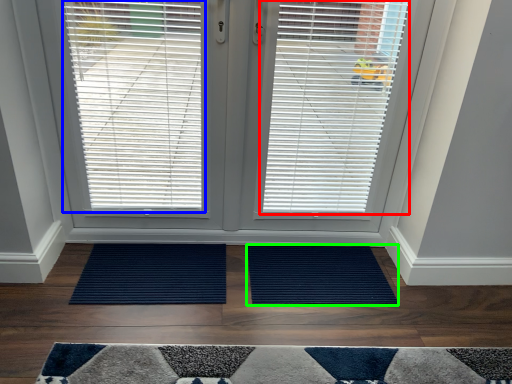
Question: Which object is positioned closest to window blind (highlighted by a red box)? Select from window blind (highlighted by a blue box) and doormat (highlighted by a green box).

Choices:
 (A) window blind
 (B) doormat

Answer: (A)